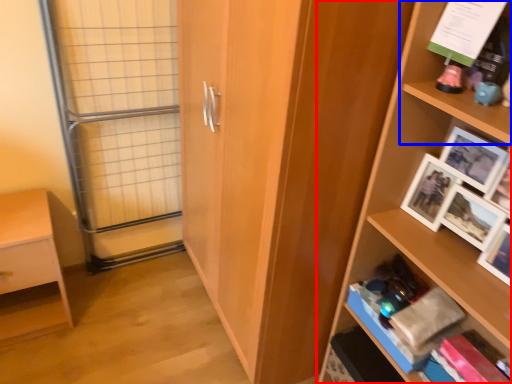
Question: Among these objects, which one is nearest to the camera, shelf (highlighted by a red box) or shelf (highlighted by a blue box)?

Choices:
 (A) shelf
 (B) shelf

Answer: (A)